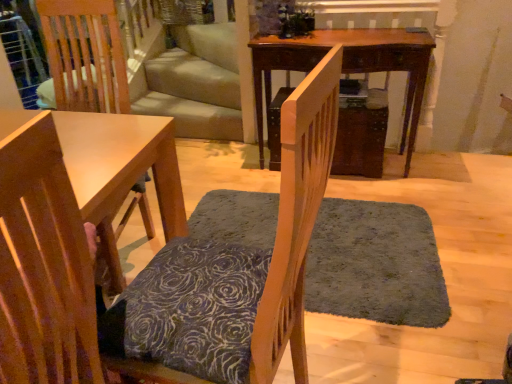
Find the location of a particular element. vacant space underneath dark gray shaggy rug at center (from a real-world perspective) is located at coordinates (374, 261).